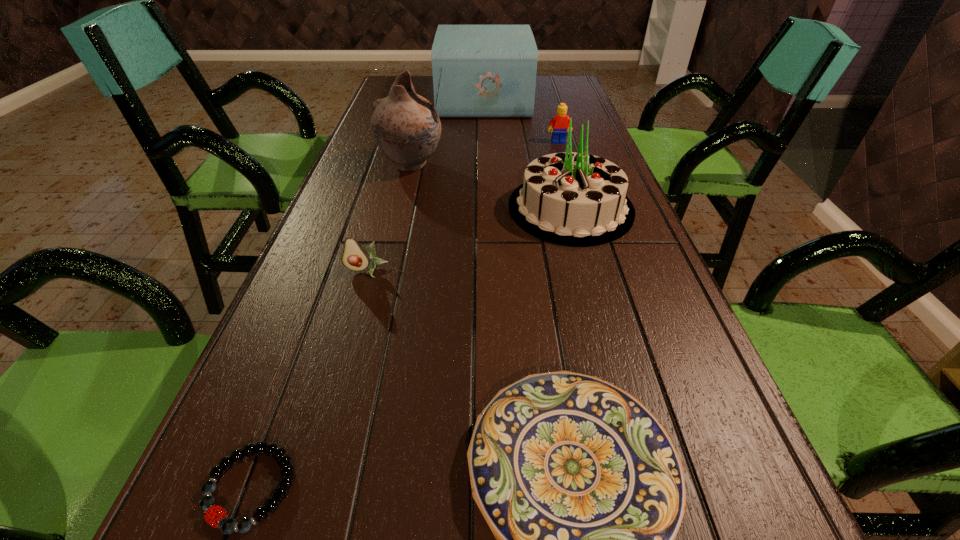
I want to click on birthday cake that is at the right edge, so click(x=574, y=199).

At what (x,y) coordinates should I click in order to perform the action: click on Lego situated at the right edge. Please return your answer as a coordinate pair (x, y). The height and width of the screenshot is (540, 960). Looking at the image, I should click on (560, 122).

Find the location of a particular element. The image size is (960, 540). vacant space at the far edge is located at coordinates (427, 88).

The height and width of the screenshot is (540, 960). I want to click on vacant space at the left edge of the desktop, so click(x=303, y=455).

The image size is (960, 540). In the image, there is a desktop. Identify the location of vacant space at the right edge. (544, 113).

I want to click on free space at the far left corner of the desktop, so tap(389, 85).

The image size is (960, 540). What are the coordinates of `vacant space at the far right corner` in the screenshot? It's located at (570, 81).

At what (x,y) coordinates should I click in order to perform the action: click on vacant space that is in between the birthday cake and the radio receiver. Please return your answer as a coordinate pair (x, y). Looking at the image, I should click on (527, 154).

Identify the location of free space between the birthday cake and the radio receiver. The height and width of the screenshot is (540, 960). (527, 154).

Find the location of a particular element. The height and width of the screenshot is (540, 960). free space between the Lego and the bracelet is located at coordinates (404, 315).